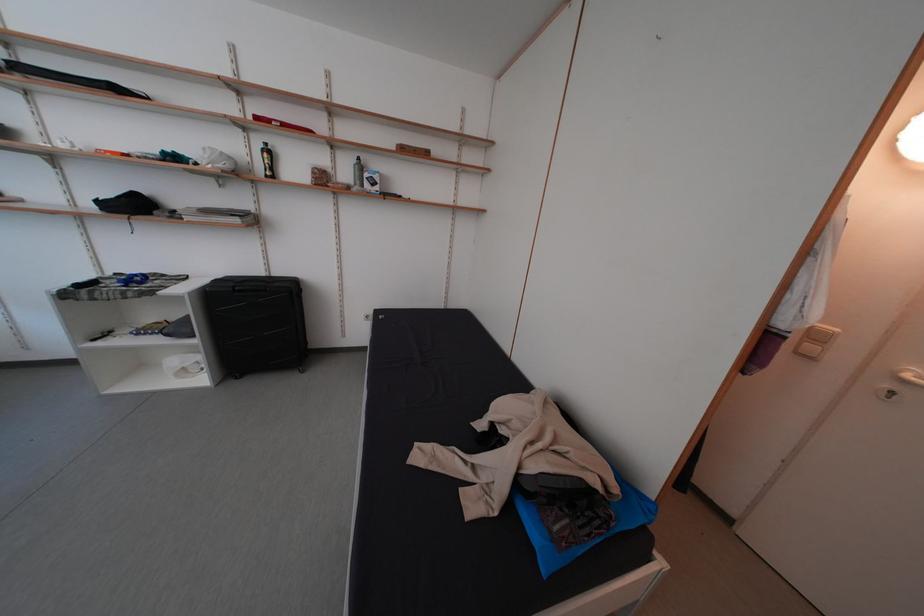
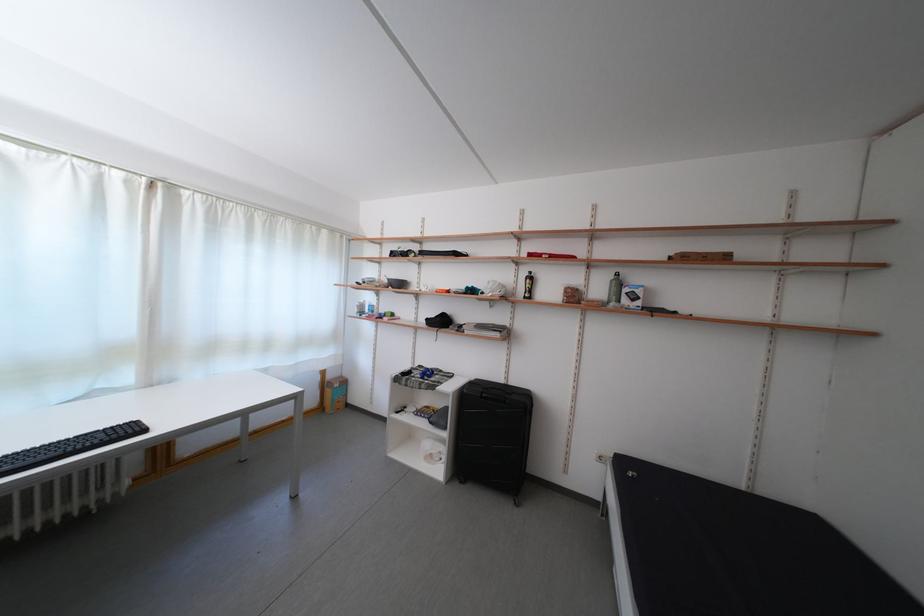
In the scene shown: How did the camera likely rotate?

The rotation direction of the camera is left-up.